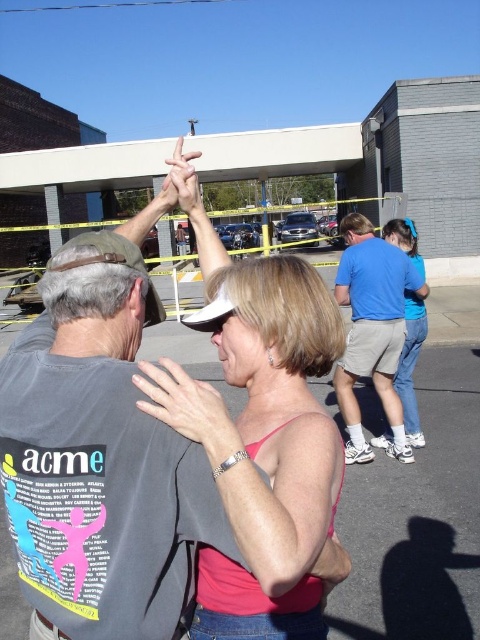
You are a photographer trying to capture a clear shot of the pink fabric top at center and the matte white hand at center. Which object is positioned closer to your camera lens?

→ The pink fabric top at center is closer to the viewer than the matte white hand at center, so the pink fabric top at center would be closer to your camera lens.

You are organizing a clothing display and need to arrange the pink matte tank top at center and the blue cotton shirt at center on a rack. Which item should you place on the top shelf to ensure the smaller one is visible?

The pink matte tank top at center is smaller than the blue cotton shirt at center, so you should place the pink matte tank top at center on the top shelf to ensure it is visible.

You are at the event and want to find the pink fabric top at center. According to the coordinates provided, where should you look relative to the other objects in the scene?

The pink fabric top at center is located at point 0.692 on the x axis and 0.550 on the y axis.